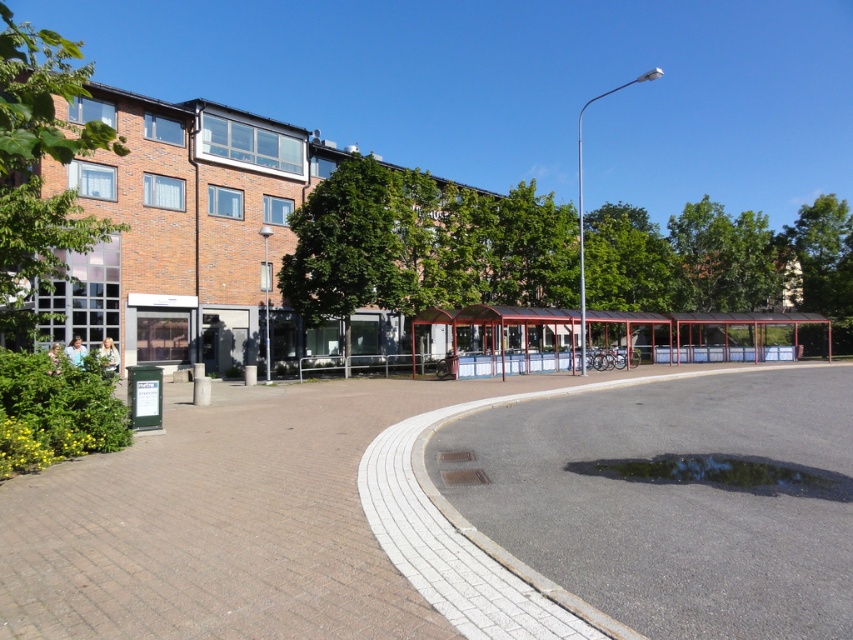
You are a pedestrian approaching the bus stop. From your perspective, which object is closer to you between the metallic red bus stop at center and the transparent wet asphalt at lower center?

The metallic red bus stop at center is closer to you because it is further to the viewer than the transparent wet asphalt at lower center, meaning it appears nearer in the scene.

You are a pedestrian standing at the brick pavement at lower left and want to reach the metallic red bus stop at center. Which direction should you walk to get there?

Since the brick pavement at lower left is closer to the viewer than the metallic red bus stop at center, you should walk towards the center of the image to reach the metallic red bus stop at center.

You are a pedestrian trying to reach the bus stop. You see the metallic red bus stop at center and the transparent wet asphalt at lower center. Which object is larger in size?

The metallic red bus stop at center is bigger than transparent wet asphalt at lower center, so the metallic red bus stop at center is larger in size.